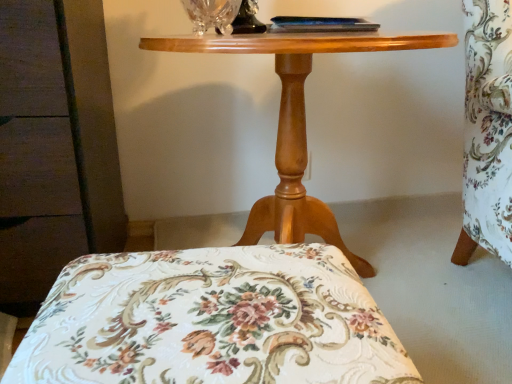
Based on the photo, in order to face floral fabric cushion at center, should I rotate leftwards or rightwards?

It's best to rotate left around 5.588 degrees.

Identify the location of transparent crystal vase at upper center. Image resolution: width=512 pixels, height=384 pixels. [x=212, y=15].

What do you see at coordinates (296, 122) in the screenshot? I see `wooden table at center` at bounding box center [296, 122].

You are a GUI agent. You are given a task and a screenshot of the screen. Output one action in this format:
    pyautogui.click(x=<x>, y=<y>)
    Task: Click on the floral fabric cushion at center
    This screenshot has height=384, width=512.
    Given the screenshot: What is the action you would take?
    pyautogui.click(x=211, y=321)

Is clear glass table lamp at upper center a part of transparent crystal vase at upper center?

No.

From the picture: Is the depth of transparent crystal vase at upper center greater than that of clear glass table lamp at upper center?

No, transparent crystal vase at upper center is closer to the camera.

Between point (198, 32) and point (243, 3), which one is positioned behind?

Point (243, 3)

Is clear glass table lamp at upper center inside the boundaries of wooden table at center, or outside?

clear glass table lamp at upper center is not inside wooden table at center, it's outside.

From a real-world perspective, is clear glass table lamp at upper center physically located above or below wooden table at center?

In terms of real-world spatial position, clear glass table lamp at upper center is above wooden table at center.

Is clear glass table lamp at upper center positioned with its back to wooden table at center?

No.

From the picture: Does clear glass table lamp at upper center lie in front of wooden table at center?

No, clear glass table lamp at upper center is behind wooden table at center.

How far apart are wooden table at center and clear glass table lamp at upper center?

wooden table at center is 30.23 centimeters from clear glass table lamp at upper center.

Considering the relative sizes of wooden table at center and clear glass table lamp at upper center in the image provided, is wooden table at center taller than clear glass table lamp at upper center?

Yes, wooden table at center is taller than clear glass table lamp at upper center.

In the image, is wooden table at center positioned in front of or behind clear glass table lamp at upper center?

wooden table at center is positioned closer to the viewer than clear glass table lamp at upper center.

From the image's perspective, who appears lower, wooden table at center or clear glass table lamp at upper center?

wooden table at center appears lower in the image.

Is there a large distance between floral fabric cushion at center and wooden table at center?

floral fabric cushion at center is near wooden table at center, not far away.

Which is more distant, (x=198, y=297) or (x=298, y=155)?

The point (x=298, y=155) is farther.

From the image's perspective, which one is positioned lower, floral fabric cushion at center or wooden table at center?

floral fabric cushion at center.

Is floral fabric cushion at center facing away from wooden table at center?

No.

Is floral fabric cushion at center at the right side of clear glass table lamp at upper center?

No.

The image size is (512, 384). Identify the location of table lamp located above the floral fabric cushion at center (from a real-world perspective). (247, 19).

Considering their positions, is floral fabric cushion at center located in front of or behind clear glass table lamp at upper center?

Visually, floral fabric cushion at center is located in front of clear glass table lamp at upper center.

From the image's perspective, is transparent crystal vase at upper center beneath floral fabric cushion at center?

Actually, transparent crystal vase at upper center appears above floral fabric cushion at center in the image.

Which is less distant, (206, 1) or (241, 326)?

Point (206, 1) appears to be farther away from the viewer than point (241, 326).

Can you confirm if transparent crystal vase at upper center is shorter than floral fabric cushion at center?

Indeed, transparent crystal vase at upper center has a lesser height compared to floral fabric cushion at center.

Considering the relative sizes of wooden table at center and floral fabric cushion at center in the image provided, is wooden table at center bigger than floral fabric cushion at center?

Yes, wooden table at center is bigger than floral fabric cushion at center.

Could you tell me if wooden table at center is turned towards floral fabric cushion at center?

Yes, wooden table at center is turned towards floral fabric cushion at center.

How different are the orientations of wooden table at center and floral fabric cushion at center in degrees?

wooden table at center and floral fabric cushion at center are facing 177 degrees away from each other.

From the image's perspective, between wooden table at center and floral fabric cushion at center, which one is located above?

wooden table at center.

I want to click on table lamp above the transparent crystal vase at upper center (from the image's perspective), so click(247, 19).

You are a GUI agent. You are given a task and a screenshot of the screen. Output one action in this format:
    pyautogui.click(x=<x>, y=<y>)
    Task: Click on the table below the clear glass table lamp at upper center (from the image's perspective)
    This screenshot has height=384, width=512.
    Given the screenshot: What is the action you would take?
    pyautogui.click(x=296, y=122)

Which object lies further to the anchor point clear glass table lamp at upper center, transparent crystal vase at upper center or floral fabric cushion at center?

The object further to clear glass table lamp at upper center is floral fabric cushion at center.

Estimate the real-world distances between objects in this image. Which object is closer to transparent crystal vase at upper center, wooden table at center or clear glass table lamp at upper center?

Among the two, clear glass table lamp at upper center is located nearer to transparent crystal vase at upper center.

Which object lies further to the anchor point wooden table at center, transparent crystal vase at upper center or clear glass table lamp at upper center?

The object further to wooden table at center is clear glass table lamp at upper center.

Based on their spatial positions, is clear glass table lamp at upper center or floral fabric cushion at center closer to wooden table at center?

clear glass table lamp at upper center is closer to wooden table at center.

Consider the image. From the image, which object appears to be farther from floral fabric cushion at center, clear glass table lamp at upper center or wooden table at center?

The object further to floral fabric cushion at center is clear glass table lamp at upper center.

From the image, which object appears to be farther from wooden table at center, floral fabric cushion at center or transparent crystal vase at upper center?

Among the two, floral fabric cushion at center is located further to wooden table at center.

When comparing their distances from floral fabric cushion at center, does transparent crystal vase at upper center or clear glass table lamp at upper center seem closer?

transparent crystal vase at upper center is positioned closer to the anchor floral fabric cushion at center.

Which object lies further to the anchor point transparent crystal vase at upper center, floral fabric cushion at center or wooden table at center?

The object further to transparent crystal vase at upper center is floral fabric cushion at center.

Where is `table between transparent crystal vase at upper center and floral fabric cushion at center in the vertical direction`? table between transparent crystal vase at upper center and floral fabric cushion at center in the vertical direction is located at coordinates (296, 122).

This screenshot has width=512, height=384. Find the location of `glass vase between clear glass table lamp at upper center and wooden table at center in the vertical direction`. glass vase between clear glass table lamp at upper center and wooden table at center in the vertical direction is located at coordinates (212, 15).

Where is `table between clear glass table lamp at upper center and floral fabric cushion at center from top to bottom`? This screenshot has width=512, height=384. table between clear glass table lamp at upper center and floral fabric cushion at center from top to bottom is located at coordinates (296, 122).

Locate an element on the screen. The image size is (512, 384). glass vase between clear glass table lamp at upper center and floral fabric cushion at center in the up-down direction is located at coordinates (212, 15).